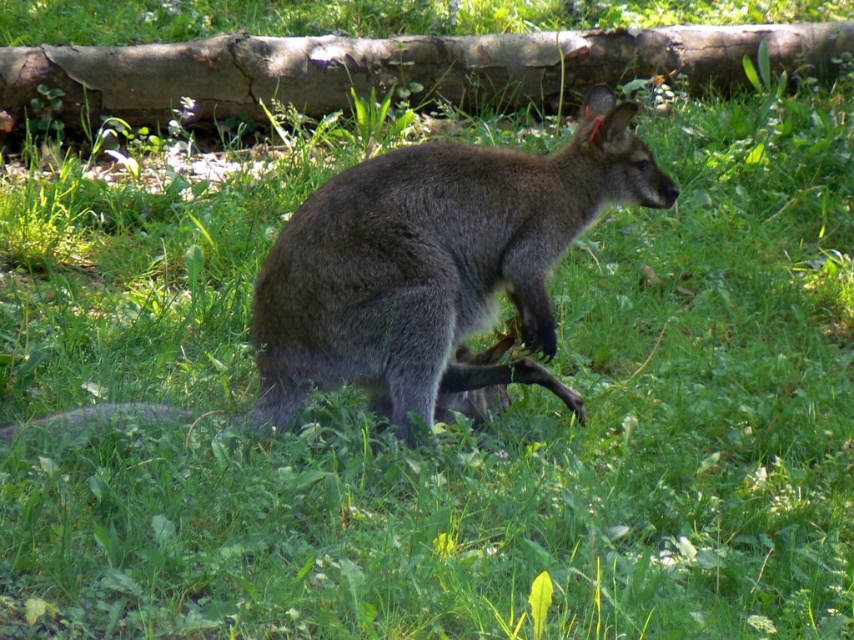
You are standing in the scene and want to take a photo of the gray fur kangaroo at center. To ensure the kangaroo is centered in your photo, where should you aim your camera?

To center the gray fur kangaroo at center in your photo, aim your camera at the point specified by the coordinates 0.417 on the x axis and 0.509 on the y axis.

From the picture: You are a photographer trying to capture the gray fur kangaroo at center and the brown rough log at upper center in the same frame. Based on their positions, can you determine which object is closer to the camera?

The gray fur kangaroo at center is located below the brown rough log at upper center, which means the kangaroo is closer to the camera since it is positioned lower in the frame.

You are a photographer trying to capture the kangaroo in the center of the image. The kangaroo is at point (434, 266). If you want to place the kangaroo exactly at the center of your camera frame, which has a coordinate system where the bottom left corner is 0,0 and the top right corner is 1,1, should you move the camera up or down?

The gray fur kangaroo at center is located at point (434, 266). Since the center of the camera frame is at 0.5, 0.5, the kangaroo is slightly to the left and slightly above the center. To move it to the exact center, you should move the camera slightly to the right and slightly down. However, since the question specifically asks whether to move up or down, the vertical coordinate is 0.509, which is just above the center point of 0.5. Therefore, moving the camera down by a small amount would bring the kang